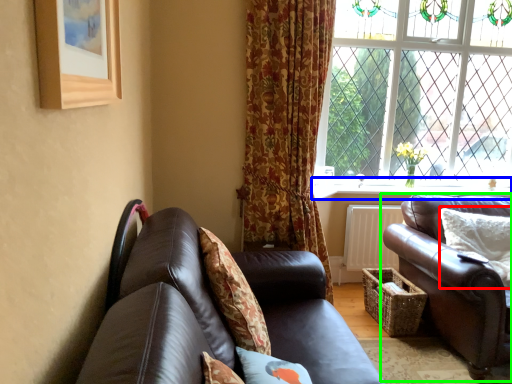
Question: Which object is the farthest from pillow (highlighted by a red box)? Choose among these: window sill (highlighted by a blue box) or studio couch (highlighted by a green box).

Choices:
 (A) window sill
 (B) studio couch

Answer: (A)